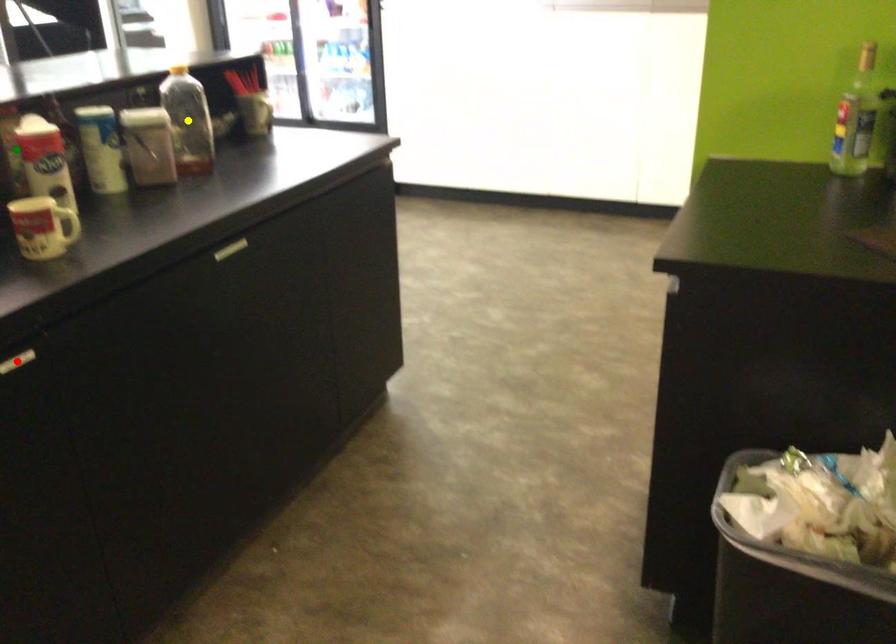
Order these from nearest to farthest:
- red point
- yellow point
- green point

red point
green point
yellow point